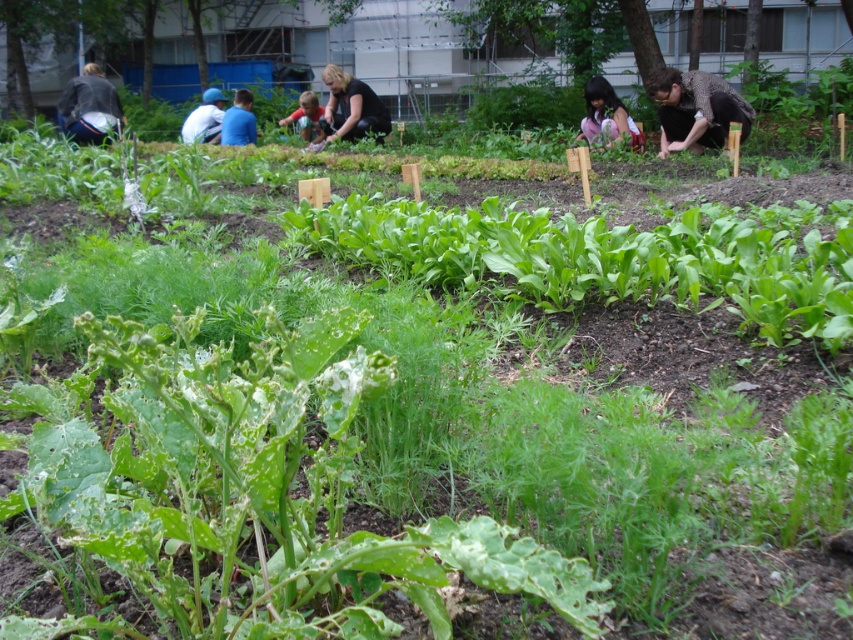
Question: Can you confirm if black matte shirt at center is positioned above white fabric at left?

Choices:
 (A) yes
 (B) no

Answer: (B)

Question: In this image, where is black matte shirt at center located relative to white fabric at left?

Choices:
 (A) above
 (B) below

Answer: (B)

Question: Which object is closer to the camera taking this photo?

Choices:
 (A) white fabric at left
 (B) speckled brown shirt at right

Answer: (B)

Question: Does dark gray jacket at upper left appear on the left side of light brown wooden stick at center?

Choices:
 (A) yes
 (B) no

Answer: (A)

Question: Based on their relative distances, which object is farther from the blue fabric shirt at upper center?

Choices:
 (A) black matte shirt at center
 (B) dark brown hair at center
 (C) dark gray jacket at upper left
 (D) speckled brown shirt at right

Answer: (D)

Question: Among these objects, which one is farthest from the camera?

Choices:
 (A) speckled brown shirt at right
 (B) white fabric at left
 (C) black matte shirt at center

Answer: (B)